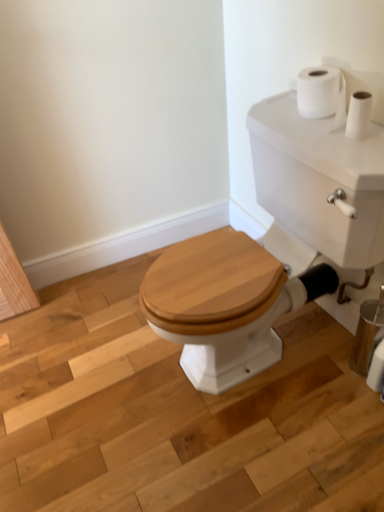
Image resolution: width=384 pixels, height=512 pixels. In order to click on white matte toilet paper at upper right, marked as the 2th toilet paper in a left-to-right arrangement in this screenshot , I will do `click(376, 369)`.

This screenshot has width=384, height=512. What do you see at coordinates (323, 94) in the screenshot? I see `white matte toilet paper at upper right, acting as the second toilet paper starting from the right` at bounding box center [323, 94].

Find the location of a particular element. The height and width of the screenshot is (512, 384). wooden toilet seat at center is located at coordinates (177, 414).

Is point (369, 109) positioned behind point (375, 359)?

No, it is in front of (375, 359).

Are white matte toilet paper at upper right, the second toilet paper in the bottom-to-top sequence, and white matte toilet paper at upper right, the 1th toilet paper when ordered from right to left, far apart?

Actually, white matte toilet paper at upper right, the second toilet paper in the bottom-to-top sequence, and white matte toilet paper at upper right, the 1th toilet paper when ordered from right to left, are a little close together.

Considering their positions, is white matte toilet paper at upper right, acting as the second toilet paper starting from the right, located in front of or behind white matte toilet paper at upper right, the first toilet paper when ordered from bottom to top?

Clearly, white matte toilet paper at upper right, acting as the second toilet paper starting from the right, is in front of white matte toilet paper at upper right, the first toilet paper when ordered from bottom to top.

In terms of width, does white matte toilet paper at upper right, arranged as the first toilet paper when viewed from the top, look wider or thinner when compared to white glossy porcelain at center?

white matte toilet paper at upper right, arranged as the first toilet paper when viewed from the top, is thinner than white glossy porcelain at center.

Is the surface of white matte toilet paper at upper right, the first toilet paper positioned from the left, in direct contact with white glossy porcelain at center?

No, white matte toilet paper at upper right, the first toilet paper positioned from the left, is not with white glossy porcelain at center.

Looking at the image, does white matte toilet paper at upper right, the first toilet paper positioned from the left, seem bigger or smaller compared to white glossy porcelain at center?

In the image, white matte toilet paper at upper right, the first toilet paper positioned from the left, appears to be smaller than white glossy porcelain at center.

Consider the image. Does white matte toilet paper at upper right, arranged as the first toilet paper when viewed from the top, have a lesser height compared to white glossy porcelain at center?

Correct, white matte toilet paper at upper right, arranged as the first toilet paper when viewed from the top, is not as tall as white glossy porcelain at center.

Which of these two, white matte toilet paper at upper right, marked as the 2th toilet paper in a left-to-right arrangement, or wooden toilet seat at center, is smaller?

Smaller between the two is white matte toilet paper at upper right, marked as the 2th toilet paper in a left-to-right arrangement.

From the image's perspective, which object appears higher, white matte toilet paper at upper right, which is the second toilet paper in top-to-bottom order, or wooden toilet seat at center?

From the image's view, white matte toilet paper at upper right, which is the second toilet paper in top-to-bottom order, is above.

Is white matte toilet paper at upper right, the first toilet paper when ordered from bottom to top, oriented away from wooden toilet seat at center?

That's not correct — white matte toilet paper at upper right, the first toilet paper when ordered from bottom to top, is not looking away from wooden toilet seat at center.

From the image's perspective, does wooden toilet seat at center appear lower than white matte toilet paper at upper right, the first toilet paper when ordered from bottom to top?

Yes, from the image's perspective, wooden toilet seat at center is beneath white matte toilet paper at upper right, the first toilet paper when ordered from bottom to top.

Considering the sizes of wooden toilet seat at center and white matte toilet paper at upper right, marked as the 2th toilet paper in a left-to-right arrangement, in the image, is wooden toilet seat at center taller or shorter than white matte toilet paper at upper right, marked as the 2th toilet paper in a left-to-right arrangement,?

Considering their sizes, wooden toilet seat at center has less height than white matte toilet paper at upper right, marked as the 2th toilet paper in a left-to-right arrangement.

Considering the positions of point (297, 484) and point (383, 355), is point (297, 484) closer or farther from the camera than point (383, 355)?

Clearly, point (297, 484) is closer to the camera than point (383, 355).

From a real-world perspective, between wooden toilet seat at center and white matte toilet paper at upper right, the 1th toilet paper when ordered from right to left, who is vertically lower?

wooden toilet seat at center, from a real-world perspective.

Is white glossy porcelain at center located outside white matte toilet paper at upper right, the second toilet paper in the bottom-to-top sequence?

white glossy porcelain at center is positioned outside white matte toilet paper at upper right, the second toilet paper in the bottom-to-top sequence.

From the picture: Can you confirm if white glossy porcelain at center is shorter than white matte toilet paper at upper right, the first toilet paper positioned from the left?

In fact, white glossy porcelain at center may be taller than white matte toilet paper at upper right, the first toilet paper positioned from the left.

Is white glossy porcelain at center facing towards white matte toilet paper at upper right, acting as the second toilet paper starting from the right?

No, white glossy porcelain at center is not turned towards white matte toilet paper at upper right, acting as the second toilet paper starting from the right.

From the image's perspective, is white matte toilet paper at upper right, the second toilet paper in the bottom-to-top sequence, above or below wooden toilet seat at center?

white matte toilet paper at upper right, the second toilet paper in the bottom-to-top sequence, is situated higher than wooden toilet seat at center in the image.

Is white matte toilet paper at upper right, the first toilet paper positioned from the left, positioned with its back to wooden toilet seat at center?

No, wooden toilet seat at center is not at the back of white matte toilet paper at upper right, the first toilet paper positioned from the left.

Is white matte toilet paper at upper right, the first toilet paper positioned from the left, inside or outside of wooden toilet seat at center?

white matte toilet paper at upper right, the first toilet paper positioned from the left, is not enclosed by wooden toilet seat at center.

Is white matte toilet paper at upper right, the first toilet paper positioned from the left, positioned far away from wooden toilet seat at center?

That's not correct — white matte toilet paper at upper right, the first toilet paper positioned from the left, is a little close to wooden toilet seat at center.

Consider the image. How much distance is there between white matte toilet paper at upper right, which is the second toilet paper in top-to-bottom order, and white glossy porcelain at center?

white matte toilet paper at upper right, which is the second toilet paper in top-to-bottom order, and white glossy porcelain at center are 22.19 inches apart from each other.

Between white matte toilet paper at upper right, the 1th toilet paper when ordered from right to left, and white glossy porcelain at center, which one has smaller width?

white matte toilet paper at upper right, the 1th toilet paper when ordered from right to left.

Considering the sizes of objects white matte toilet paper at upper right, the first toilet paper when ordered from bottom to top, and white glossy porcelain at center in the image provided, who is taller, white matte toilet paper at upper right, the first toilet paper when ordered from bottom to top, or white glossy porcelain at center?

With more height is white glossy porcelain at center.

Is white matte toilet paper at upper right, the first toilet paper when ordered from bottom to top, bigger than white glossy porcelain at center?

Incorrect, white matte toilet paper at upper right, the first toilet paper when ordered from bottom to top, is not larger than white glossy porcelain at center.

I want to click on toilet paper above the white matte toilet paper at upper right, the 1th toilet paper when ordered from right to left (from the image's perspective), so click(323, 94).

This screenshot has height=512, width=384. I want to click on porcelain below the white matte toilet paper at upper right, acting as the second toilet paper starting from the right (from a real-world perspective), so click(321, 179).

From the image, which object appears to be nearer to white matte toilet paper at upper right, arranged as the first toilet paper when viewed from the top, white glossy porcelain at center or wooden toilet seat at center?

The object closer to white matte toilet paper at upper right, arranged as the first toilet paper when viewed from the top, is white glossy porcelain at center.

From the image, which object appears to be nearer to white glossy porcelain at center, white matte toilet paper at upper right, the 1th toilet paper when ordered from right to left, or wooden toilet seat at center?

Among the two, wooden toilet seat at center is located nearer to white glossy porcelain at center.

Estimate the real-world distances between objects in this image. Which object is closer to white matte toilet paper at upper right, the first toilet paper when ordered from bottom to top, white matte toilet paper at upper right, the second toilet paper in the bottom-to-top sequence, or white glossy porcelain at center?

white glossy porcelain at center is positioned closer to the anchor white matte toilet paper at upper right, the first toilet paper when ordered from bottom to top.

From the image, which object appears to be nearer to white matte toilet paper at upper right, the first toilet paper when ordered from bottom to top, wooden toilet seat at center or white glossy porcelain at center?

Among the two, white glossy porcelain at center is located nearer to white matte toilet paper at upper right, the first toilet paper when ordered from bottom to top.

Consider the image. When comparing their distances from wooden toilet seat at center, does white matte toilet paper at upper right, the second toilet paper in the bottom-to-top sequence, or white matte toilet paper at upper right, which is the second toilet paper in top-to-bottom order, seem further?

white matte toilet paper at upper right, the second toilet paper in the bottom-to-top sequence, is further to wooden toilet seat at center.

Looking at this image, based on their spatial positions, is white matte toilet paper at upper right, the first toilet paper when ordered from bottom to top, or white glossy porcelain at center closer to white matte toilet paper at upper right, arranged as the first toilet paper when viewed from the top?

white glossy porcelain at center lies closer to white matte toilet paper at upper right, arranged as the first toilet paper when viewed from the top, than the other object.

Considering their positions, is white matte toilet paper at upper right, the first toilet paper positioned from the left, positioned further to wooden toilet seat at center than white glossy porcelain at center?

white matte toilet paper at upper right, the first toilet paper positioned from the left, is positioned further to the anchor wooden toilet seat at center.

Looking at the image, which one is located closer to white glossy porcelain at center, white matte toilet paper at upper right, acting as the second toilet paper starting from the right, or white matte toilet paper at upper right, marked as the 2th toilet paper in a left-to-right arrangement?

white matte toilet paper at upper right, acting as the second toilet paper starting from the right, is positioned closer to the anchor white glossy porcelain at center.

At what (x,y) coordinates should I click in order to perform the action: click on porcelain located between wooden toilet seat at center and white matte toilet paper at upper right, the first toilet paper when ordered from bottom to top, in the left-right direction. Please return your answer as a coordinate pair (x, y). Looking at the image, I should click on (321, 179).

This screenshot has height=512, width=384. I want to click on toilet paper between white matte toilet paper at upper right, acting as the second toilet paper starting from the right, and wooden toilet seat at center in the up-down direction, so click(x=376, y=369).

You are a GUI agent. You are given a task and a screenshot of the screen. Output one action in this format:
    pyautogui.click(x=<x>, y=<y>)
    Task: Click on the porcelain that lies between white matte toilet paper at upper right, the second toilet paper in the bottom-to-top sequence, and wooden toilet seat at center from top to bottom
    The width and height of the screenshot is (384, 512).
    Given the screenshot: What is the action you would take?
    pyautogui.click(x=321, y=179)

Find the location of a particular element. This screenshot has width=384, height=512. porcelain between white matte toilet paper at upper right, arranged as the first toilet paper when viewed from the top, and white matte toilet paper at upper right, the 1th toilet paper when ordered from right to left, vertically is located at coordinates (321, 179).